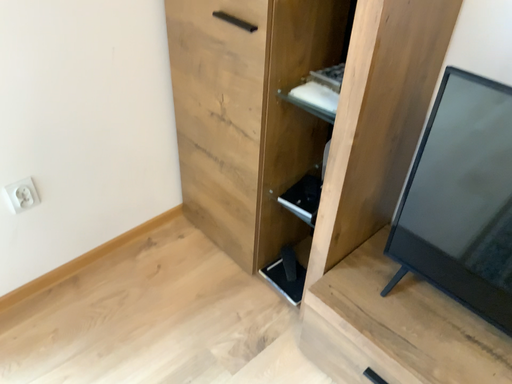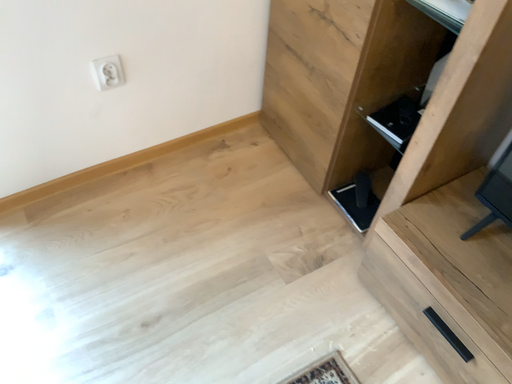
Question: Which way did the camera rotate in the video?

Choices:
 (A) rotated left
 (B) rotated right

Answer: (A)